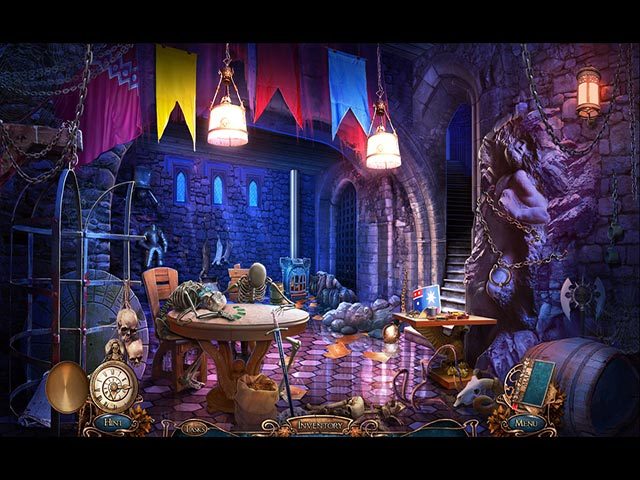
Where is `overhanging lamp shade`? overhanging lamp shade is located at coordinates (236, 120), (388, 142).